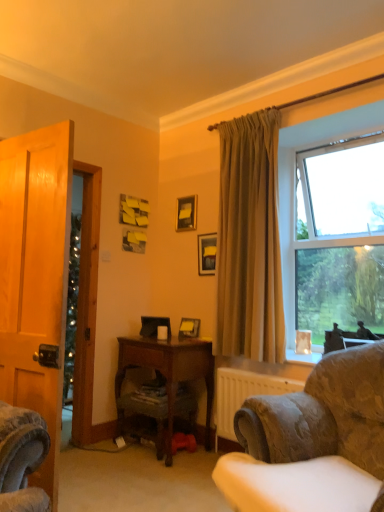
Question: Is point (274, 147) closer or farther from the camera than point (187, 228)?

Choices:
 (A) farther
 (B) closer

Answer: (B)

Question: In the image, is beige fabric curtain at upper right on the left side or the right side of matte black picture frame at upper center, marked as the 1th picture frame in a top-to-bottom arrangement?

Choices:
 (A) right
 (B) left

Answer: (A)

Question: Which object is the closest to the clear glass window at upper right?

Choices:
 (A) matte black picture frame at upper center, which ranks as the second picture frame in bottom-to-top order
 (B) matte black picture frame at upper center, marked as the 1th picture frame in a top-to-bottom arrangement
 (C) wooden picture frame at center, the 3th picture frame viewed from the top
 (D) matte white coffee cup at center
 (E) wooden desk at center

Answer: (A)

Question: Which object is positioned closest to the velvet-patterned armchair at lower right?

Choices:
 (A) wooden picture frame at center, the 3th picture frame viewed from the top
 (B) clear glass window at upper right
 (C) matte white coffee cup at center
 (D) beige fabric curtain at upper right
 (E) matte black picture frame at upper center, positioned as the 2th picture frame in top-to-bottom order

Answer: (D)